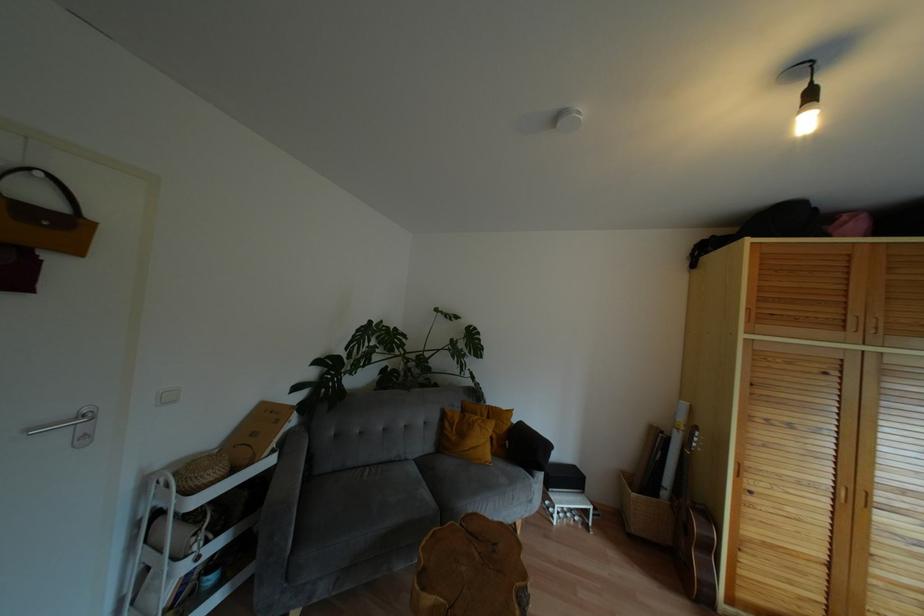
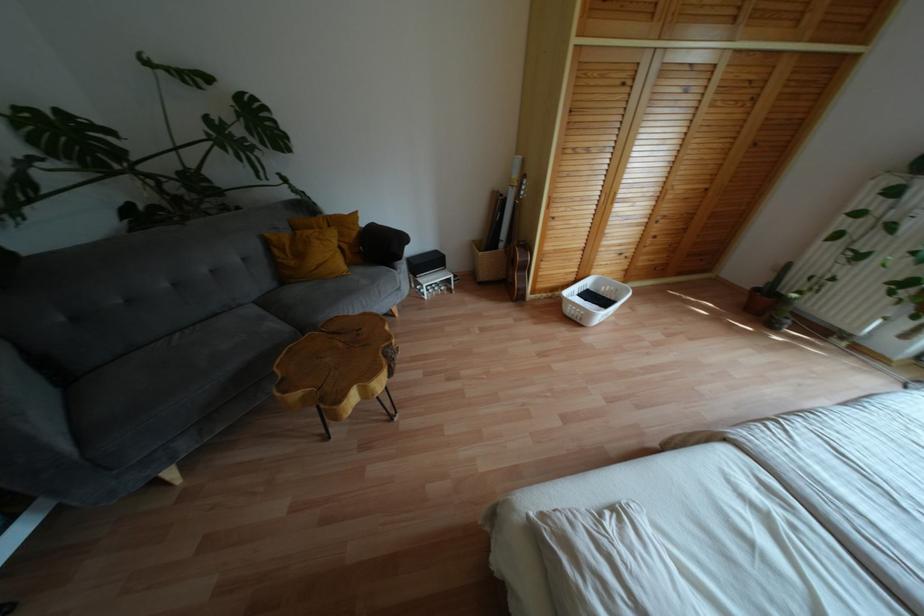
Find the pixel in the second image that matches pixel 508 411 in the first image.

(354, 214)